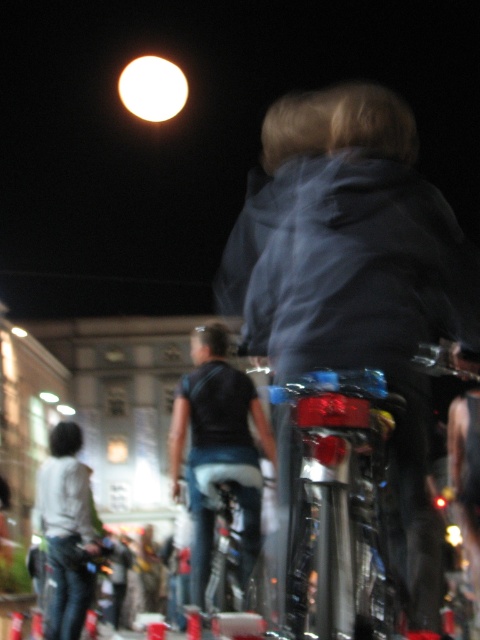
Question: Can you confirm if dark blue fabric jacket at center is positioned above white matte shirt at lower left?

Choices:
 (A) yes
 (B) no

Answer: (A)

Question: Is dark blue fabric jacket at center thinner than white matte shirt at lower left?

Choices:
 (A) no
 (B) yes

Answer: (A)

Question: Which is farther from the black matte shirt at center?

Choices:
 (A) dark blue fabric jacket at center
 (B) white matte shirt at lower left

Answer: (A)

Question: Among these objects, which one is farthest from the camera?

Choices:
 (A) dark blue fabric jacket at center
 (B) black matte shirt at center

Answer: (B)

Question: Estimate the real-world distances between objects in this image. Which object is closer to the white matte shirt at lower left?

Choices:
 (A) black matte shirt at center
 (B) dark blue fabric jacket at center

Answer: (A)

Question: Is dark blue fabric jacket at center positioned before black matte shirt at center?

Choices:
 (A) no
 (B) yes

Answer: (B)